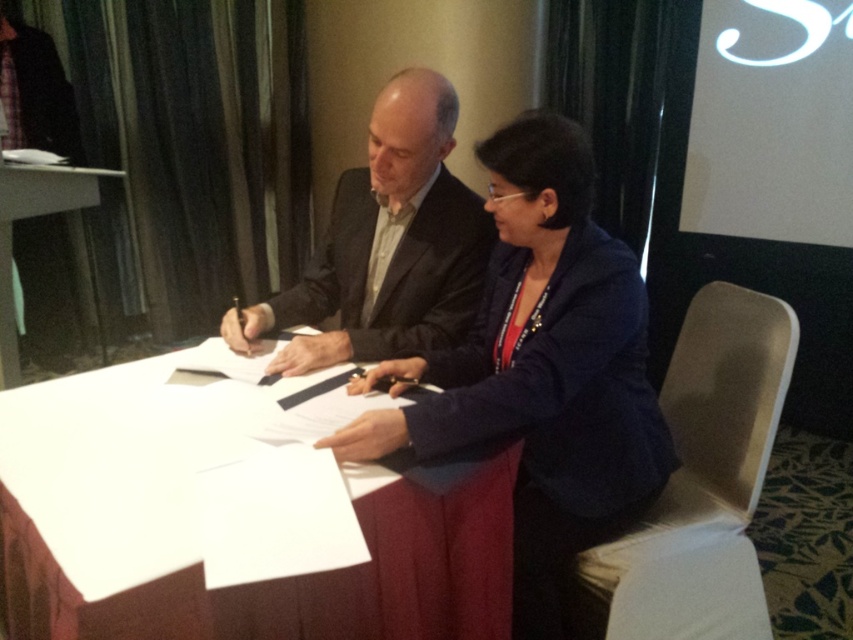
Does dark blue fabric jacket at center have a larger size compared to matte black suit at center?

Indeed, dark blue fabric jacket at center has a larger size compared to matte black suit at center.

Can you confirm if dark blue fabric jacket at center is positioned below matte black suit at center?

Yes.

Locate an element on the screen. dark blue fabric jacket at center is located at coordinates (541, 369).

Does white paper at center lie in front of matte black suit at center?

Yes.

Which is in front, point (165, 417) or point (397, 97)?

Positioned in front is point (165, 417).

What do you see at coordinates (200, 525) in the screenshot? The height and width of the screenshot is (640, 853). I see `white paper at center` at bounding box center [200, 525].

Image resolution: width=853 pixels, height=640 pixels. In order to click on white paper at center in this screenshot , I will do `click(200, 525)`.

Who is taller, white paper at center or dark blue fabric jacket at center?

Standing taller between the two is dark blue fabric jacket at center.

Who is more forward, (0,492) or (567,435)?

Point (0,492)

The image size is (853, 640). Find the location of `white paper at center`. white paper at center is located at coordinates (200, 525).